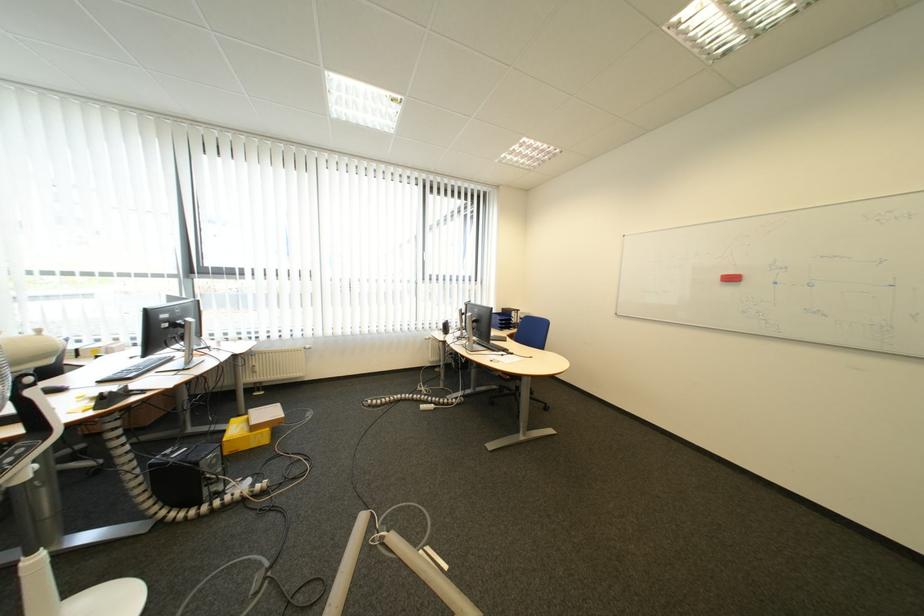
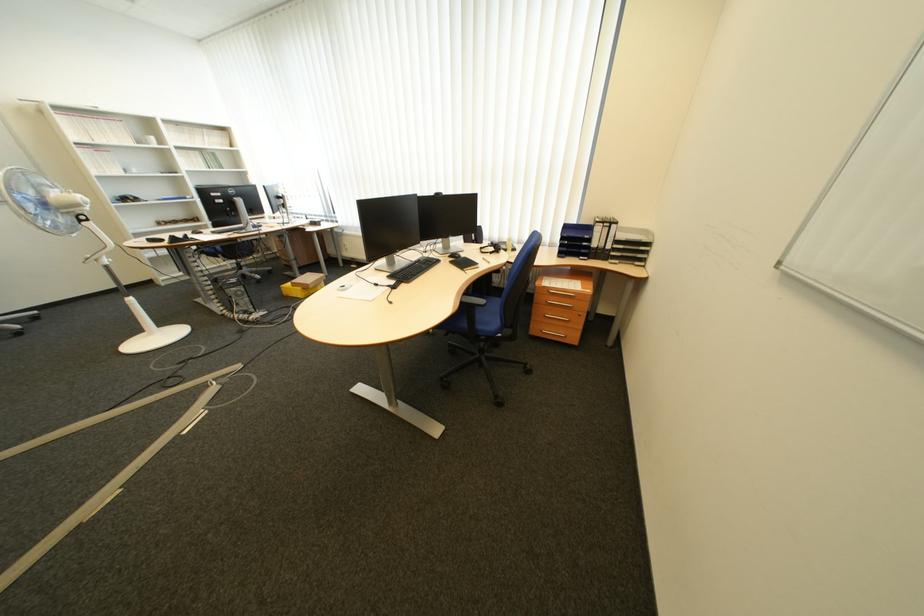
Locate, in the second image, the point that corresponds to pixel 282 430 in the first image.

(313, 290)